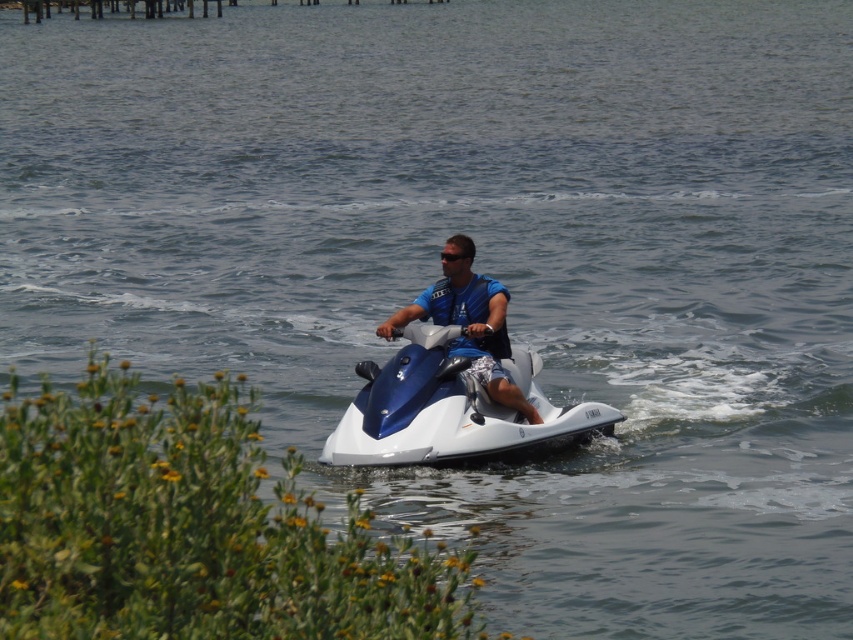
Find the location of a particular element. This screenshot has height=640, width=853. blue glossy snowmobile at center is located at coordinates (447, 408).

Is blue glossy snowmobile at center shorter than blue matte life vest at center?

Indeed, blue glossy snowmobile at center has a lesser height compared to blue matte life vest at center.

Image resolution: width=853 pixels, height=640 pixels. Describe the element at coordinates (447, 408) in the screenshot. I see `blue glossy snowmobile at center` at that location.

Image resolution: width=853 pixels, height=640 pixels. Find the location of `blue glossy snowmobile at center`. blue glossy snowmobile at center is located at coordinates (447, 408).

Can you confirm if blue matte life vest at center is positioned below black plastic goggles at center?

Yes.

Is point (465, 278) less distant than point (442, 256)?

Yes, point (465, 278) is in front of point (442, 256).

Between point (434, 310) and point (444, 252), which one is positioned behind?

The point (444, 252) is more distant.

You are a GUI agent. You are given a task and a screenshot of the screen. Output one action in this format:
    pyautogui.click(x=<x>, y=<y>)
    Task: Click on the blue matte life vest at center
    The width and height of the screenshot is (853, 640).
    Given the screenshot: What is the action you would take?
    pyautogui.click(x=469, y=323)

Who is taller, blue glossy snowmobile at center or black plastic goggles at center?

blue glossy snowmobile at center

Is point (438, 433) closer to camera compared to point (444, 253)?

Yes, point (438, 433) is closer to viewer.

Find the location of a particular element. This screenshot has width=853, height=640. blue glossy snowmobile at center is located at coordinates (447, 408).

Identify the location of blue glossy snowmobile at center. The width and height of the screenshot is (853, 640). (447, 408).